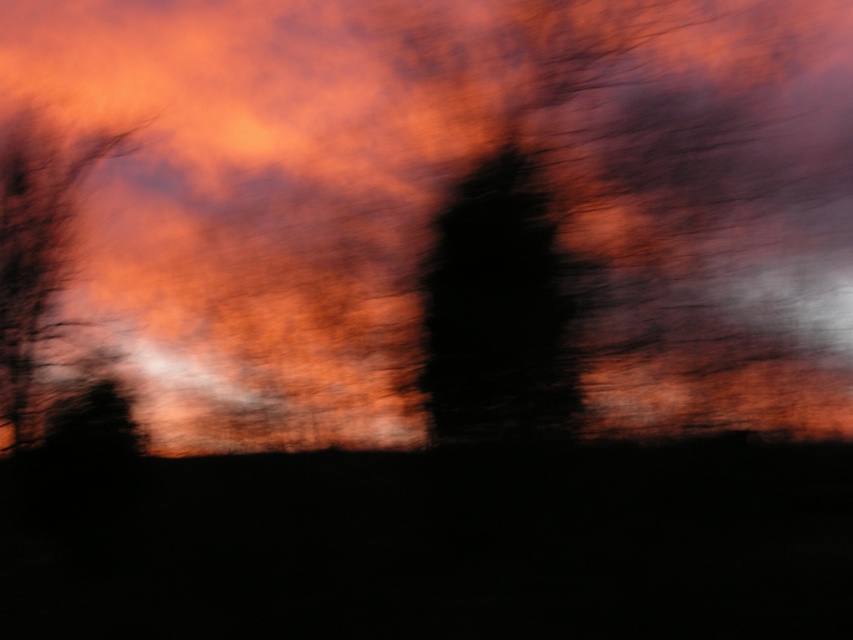
Question: Is orange matte cloud at upper center thinner than black matte tree at center?

Choices:
 (A) yes
 (B) no

Answer: (B)

Question: Which of the following is the farthest from the observer?

Choices:
 (A) black matte tree at center
 (B) orange matte cloud at upper center

Answer: (B)

Question: Based on their relative distances, which object is farther from the black matte tree at center?

Choices:
 (A) orange matte cloud at upper center
 (B) smooth bark tree at left

Answer: (B)

Question: Can you confirm if orange matte cloud at upper center is smaller than black matte tree at center?

Choices:
 (A) no
 (B) yes

Answer: (A)

Question: Does black matte tree at center appear over smooth bark tree at left?

Choices:
 (A) no
 (B) yes

Answer: (A)

Question: Which point is farther from the camera taking this photo?

Choices:
 (A) (532, 218)
 (B) (12, 147)

Answer: (B)